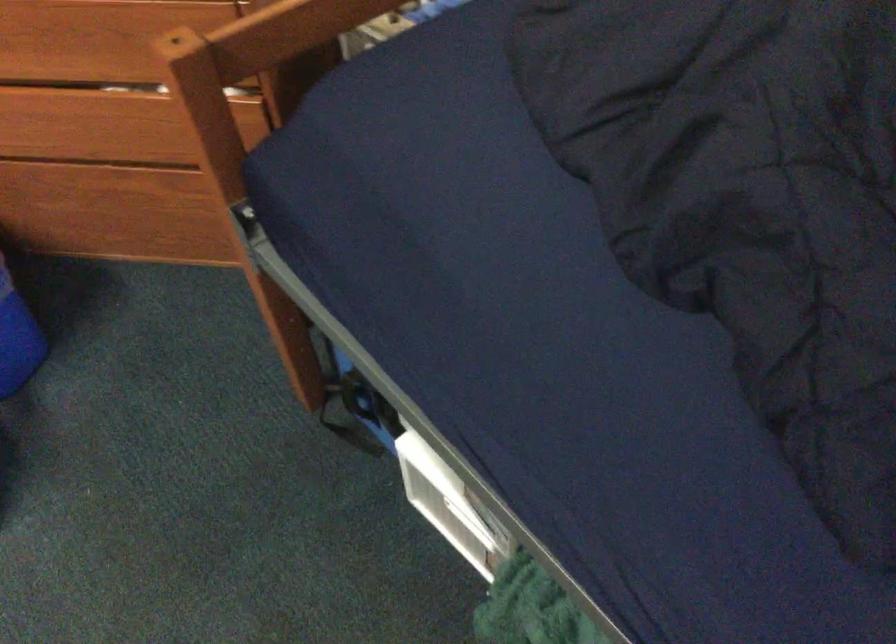
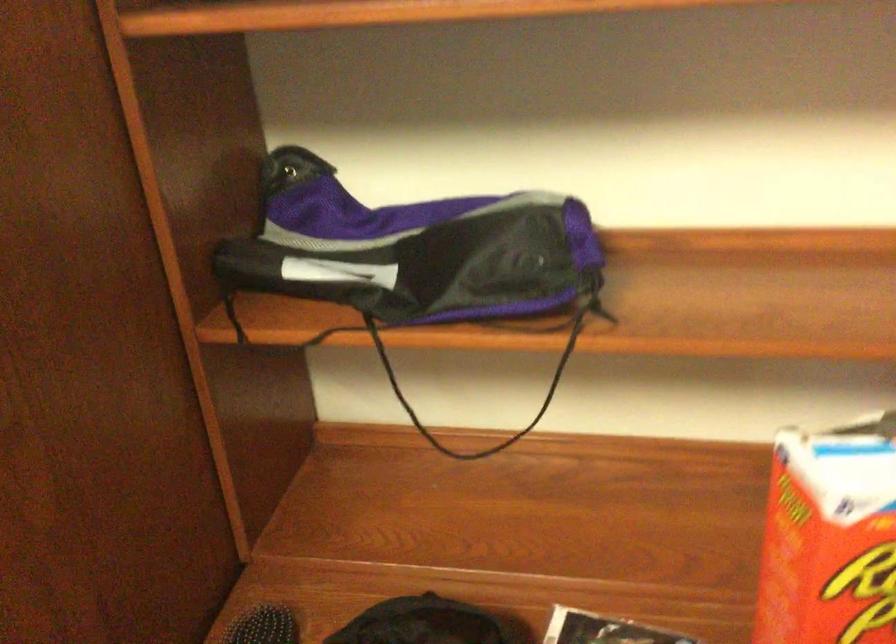
In a continuous first-person perspective shot, in which direction is the camera moving?

The movement direction of the cameraman is left, forward.